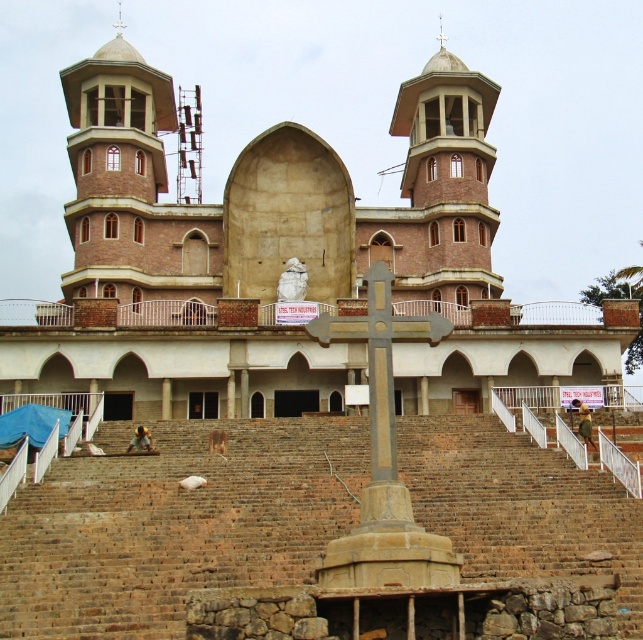
Does brown brick tower at upper left appear on the right side of brick tower at center?

In fact, brown brick tower at upper left is to the left of brick tower at center.

Between brown brick tower at upper left and brick tower at center, which one has more height?

brown brick tower at upper left

What do you see at coordinates (136, 186) in the screenshot?
I see `brown brick tower at upper left` at bounding box center [136, 186].

Locate an element on the screen. The height and width of the screenshot is (640, 643). brown brick tower at upper left is located at coordinates pyautogui.click(x=136, y=186).

Is point (210, 428) positioned before point (471, 102)?

Yes, it is.

Does brown brick stairs at center have a lesser height compared to brick tower at center?

Correct, brown brick stairs at center is not as tall as brick tower at center.

Locate an element on the screen. brown brick stairs at center is located at coordinates (174, 524).

Identify the location of brown brick stairs at center. Image resolution: width=643 pixels, height=640 pixels. (174, 524).

Based on the photo, measure the distance from brown brick stairs at center to brown brick tower at upper left.

The distance of brown brick stairs at center from brown brick tower at upper left is 115.50 feet.

Between point (109, 636) and point (68, 97), which one is positioned in front?

Point (109, 636) is in front.

Locate an element on the screen. The height and width of the screenshot is (640, 643). brown brick stairs at center is located at coordinates (174, 524).